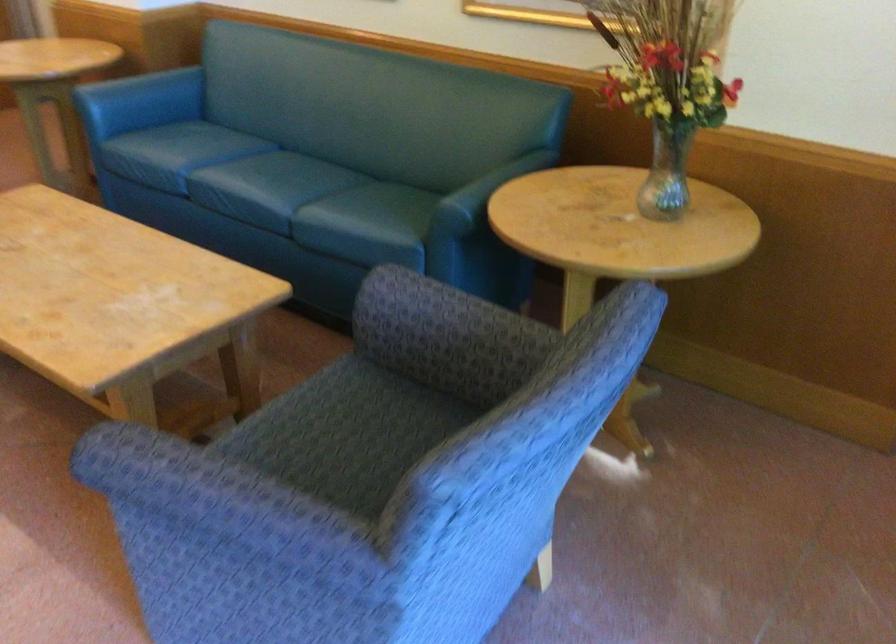
Where would you sit the patterned chair sitting surface? Please return your answer as a coordinate pair (x, y).

(333, 418)